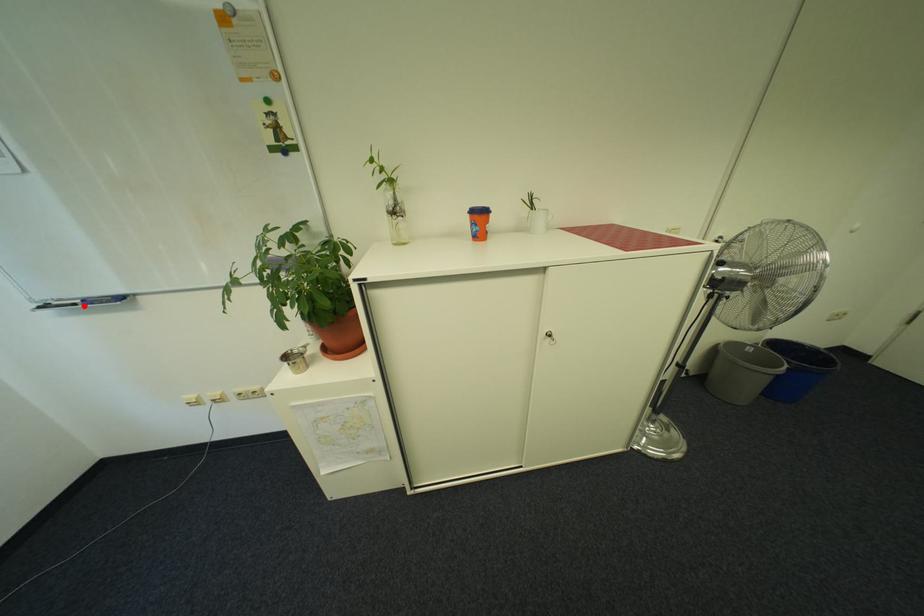
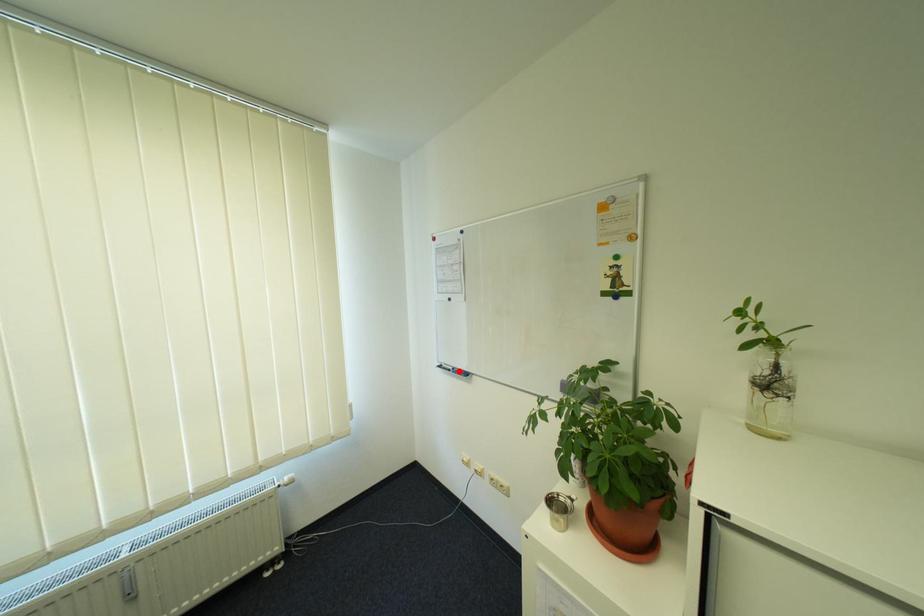
I am providing you with two images of the same scene from different viewpoints. A red point is marked on the first image and another point is marked on the second image. Is the marked point in image1 the same physical position as the marked point in image2?

Yes